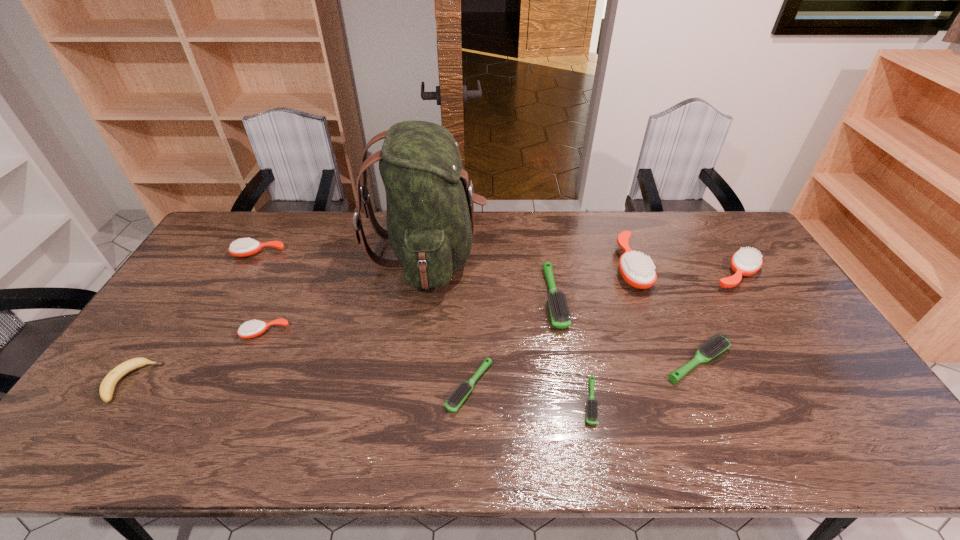
Where is `the sixth hairbrush from right to left`? the sixth hairbrush from right to left is located at coordinates (456, 399).

Locate an element on the screen. This screenshot has width=960, height=540. the second smallest light hairbrush is located at coordinates (456, 399).

Identify the location of banana. The image size is (960, 540). (107, 387).

The image size is (960, 540). Identify the location of the shortest object. (591, 413).

Locate an element on the screen. This screenshot has width=960, height=540. the shortest hairbrush is located at coordinates (591, 413).

Locate an element on the screen. The width and height of the screenshot is (960, 540). vacant space located on the open flap of the tallest object is located at coordinates (507, 254).

Locate an element on the screen. The image size is (960, 540). free space located 0.320m on the right of the second orange hairbrush from right to left is located at coordinates (742, 266).

This screenshot has width=960, height=540. I want to click on vacant space positioned on the back of the rightmost object, so click(700, 218).

Locate an element on the screen. vacant space located 0.240m on the right of the third biggest orange hairbrush is located at coordinates (355, 254).

Locate an element on the screen. free spot located on the back of the farthest light hairbrush is located at coordinates (542, 226).